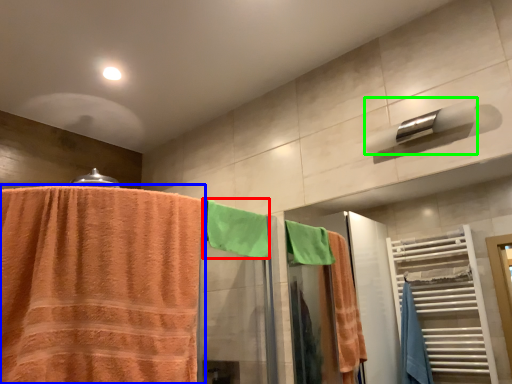
Question: Which object is the closest to the beach towel (highlighted by a red box)? Choose among these: towel (highlighted by a blue box) or towel bar (highlighted by a green box).

Choices:
 (A) towel
 (B) towel bar

Answer: (A)